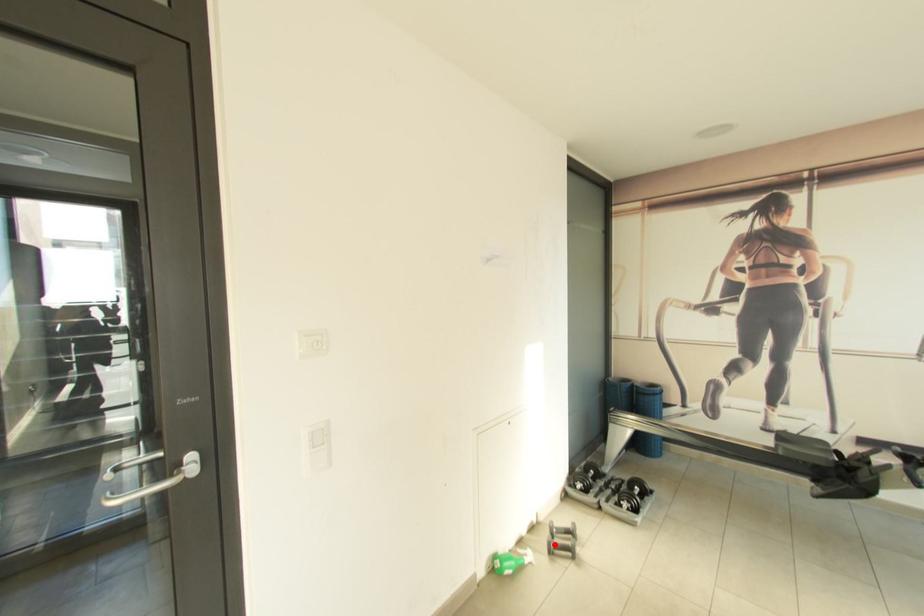
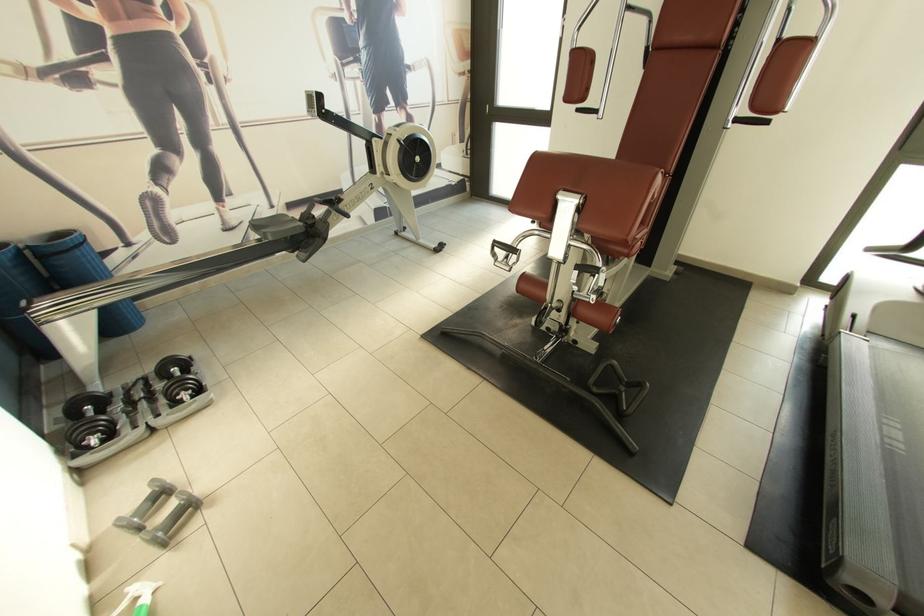
The point at the highlighted location is marked in the first image. Where is the corresponding point in the second image?

(159, 541)